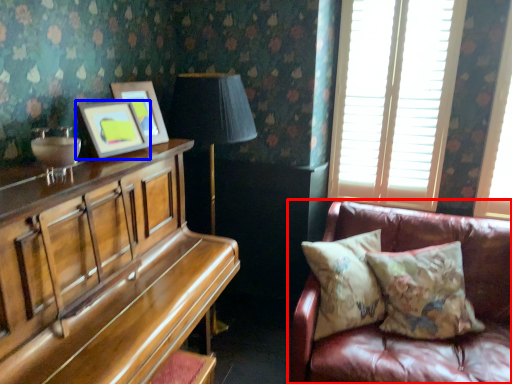
Question: Which object is closer to the camera taking this photo, studio couch (highlighted by a red box) or picture frame (highlighted by a blue box)?

Choices:
 (A) studio couch
 (B) picture frame

Answer: (A)